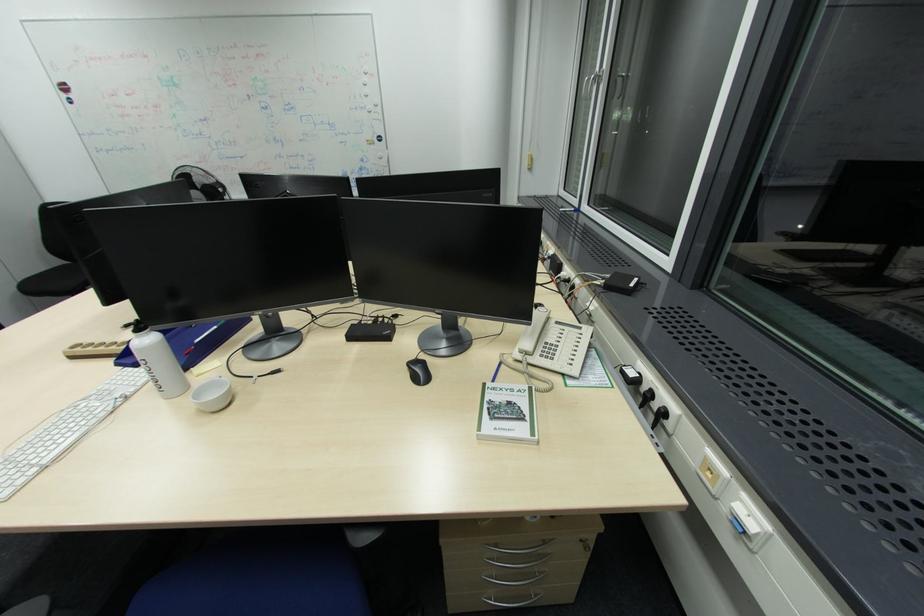
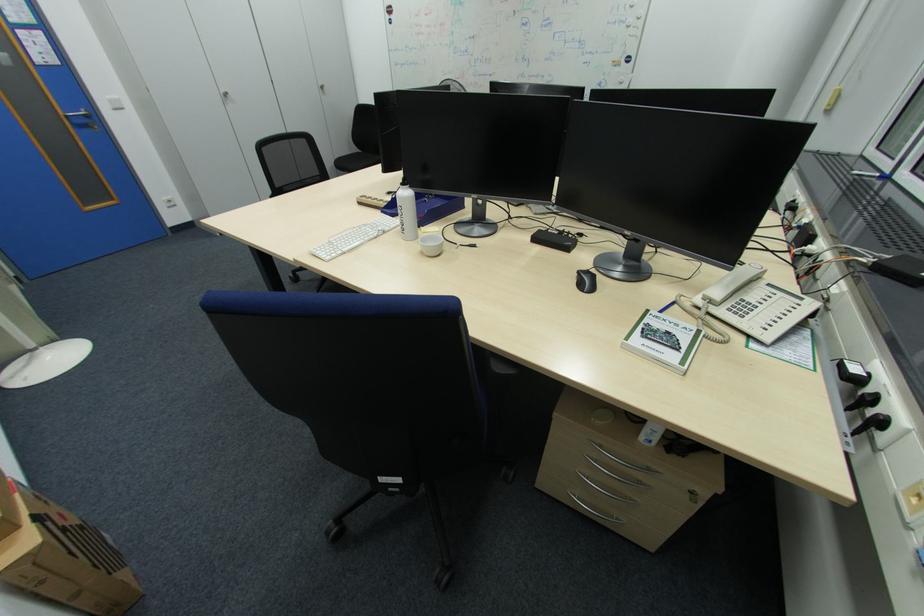
Question: The camera is either moving clockwise (left) or counter-clockwise (right) around the object. The first image is from the beginning of the video and the second image is from the end. Is the camera moving left or right when shooting the video?

Choices:
 (A) Left
 (B) Right

Answer: (B)